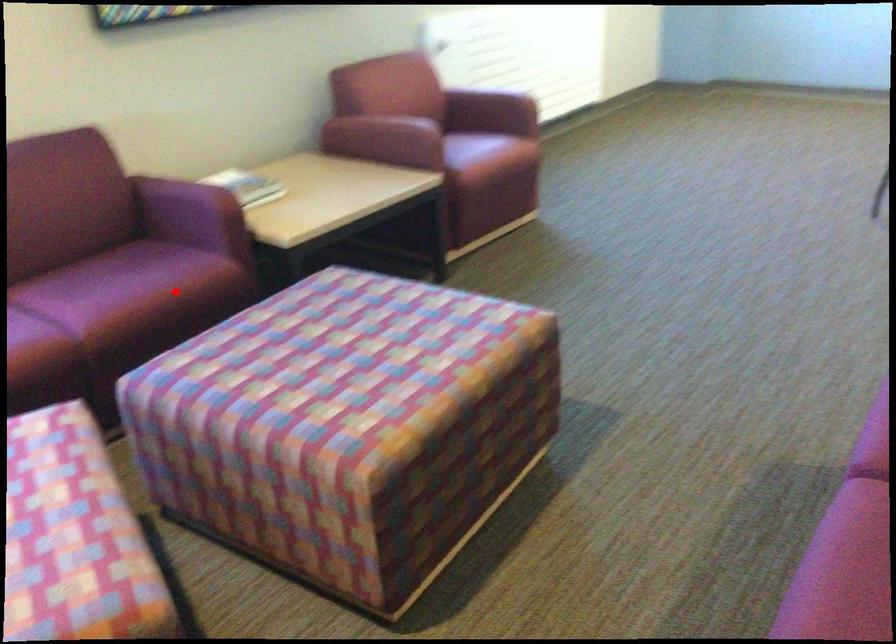
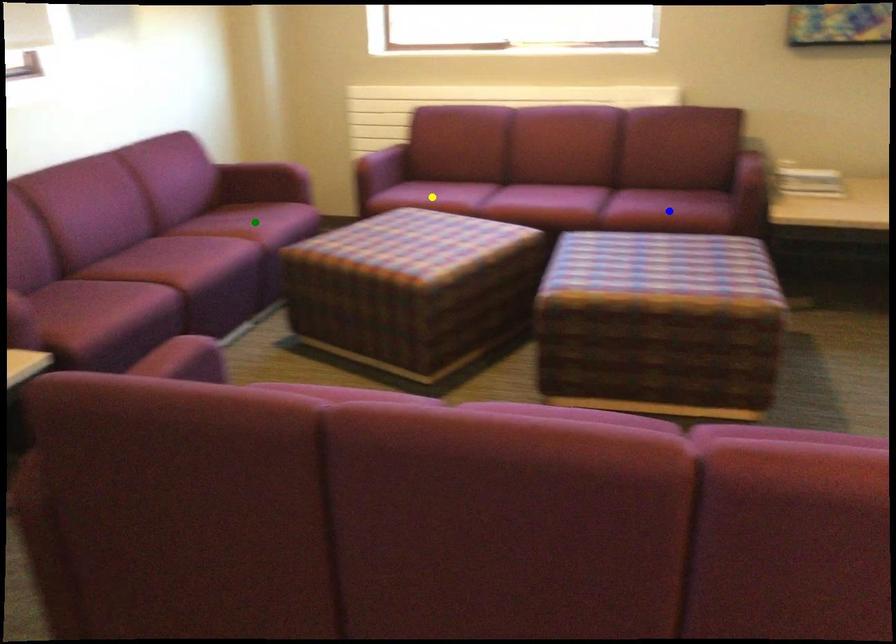
Question: I am providing you with two images of the same scene from different viewpoints. A red point is marked on the first image. You are given multiple points on the second image. Which spot in image 2 lines up with the point in image 1?

Choices:
 (A) green point
 (B) yellow point
 (C) blue point

Answer: (C)